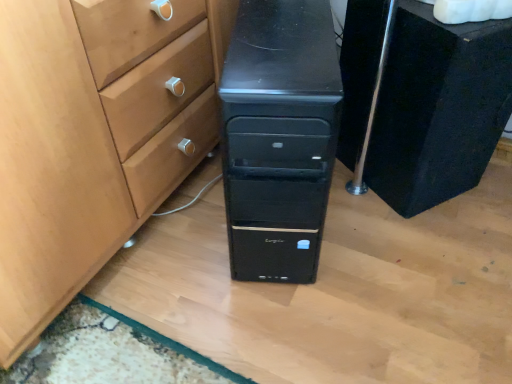
Question: Should I look upward or downward to see black matte chest of drawers at center, which appears as the first chest of drawers when viewed from the right?

Choices:
 (A) down
 (B) up

Answer: (B)

Question: Is black matte chest of drawers at center, which ranks as the first chest of drawers in left-to-right order, positioned beyond the bounds of black matte chest of drawers at center, which is the 2th chest of drawers from left to right?

Choices:
 (A) no
 (B) yes

Answer: (B)

Question: Can you confirm if black matte chest of drawers at center, which appears as the second chest of drawers when viewed from the right, is taller than black matte chest of drawers at center, which appears as the first chest of drawers when viewed from the right?

Choices:
 (A) yes
 (B) no

Answer: (A)

Question: Is black matte chest of drawers at center, which appears as the second chest of drawers when viewed from the right, smaller than black matte chest of drawers at center, which appears as the first chest of drawers when viewed from the right?

Choices:
 (A) no
 (B) yes

Answer: (A)

Question: From the image's perspective, would you say black matte chest of drawers at center, which ranks as the first chest of drawers in left-to-right order, is shown under black matte chest of drawers at center, which is the 2th chest of drawers from left to right?

Choices:
 (A) no
 (B) yes

Answer: (B)

Question: From a real-world perspective, is black matte chest of drawers at center, which appears as the second chest of drawers when viewed from the right, positioned under black matte chest of drawers at center, which appears as the first chest of drawers when viewed from the right, based on gravity?

Choices:
 (A) no
 (B) yes

Answer: (A)

Question: Considering the relative positions of black matte chest of drawers at center, which ranks as the first chest of drawers in left-to-right order, and black matte chest of drawers at center, which appears as the first chest of drawers when viewed from the right, in the image provided, is black matte chest of drawers at center, which ranks as the first chest of drawers in left-to-right order, behind black matte chest of drawers at center, which appears as the first chest of drawers when viewed from the right,?

Choices:
 (A) no
 (B) yes

Answer: (A)

Question: Is black matte chest of drawers at center, which is the 2th chest of drawers from left to right, positioned far away from black matte chest of drawers at center, which ranks as the first chest of drawers in left-to-right order?

Choices:
 (A) yes
 (B) no

Answer: (B)

Question: From a real-world perspective, is black matte chest of drawers at center, which is the 2th chest of drawers from left to right, on top of black matte chest of drawers at center, which appears as the second chest of drawers when viewed from the right?

Choices:
 (A) yes
 (B) no

Answer: (B)

Question: Is black matte chest of drawers at center, which appears as the first chest of drawers when viewed from the right, aimed at black matte chest of drawers at center, which ranks as the first chest of drawers in left-to-right order?

Choices:
 (A) no
 (B) yes

Answer: (A)

Question: Can you confirm if black matte chest of drawers at center, which appears as the first chest of drawers when viewed from the right, is bigger than black matte chest of drawers at center, which ranks as the first chest of drawers in left-to-right order?

Choices:
 (A) yes
 (B) no

Answer: (B)

Question: Is black matte chest of drawers at center, which appears as the first chest of drawers when viewed from the right, not inside black matte chest of drawers at center, which appears as the second chest of drawers when viewed from the right?

Choices:
 (A) no
 (B) yes

Answer: (B)

Question: Can you confirm if black matte chest of drawers at center, which is the 2th chest of drawers from left to right, is positioned to the right of black matte chest of drawers at center, which ranks as the first chest of drawers in left-to-right order?

Choices:
 (A) no
 (B) yes

Answer: (B)

Question: Choose the correct answer: Is black matte chest of drawers at center, which appears as the first chest of drawers when viewed from the right, inside black matte chest of drawers at center, which appears as the second chest of drawers when viewed from the right, or outside it?

Choices:
 (A) outside
 (B) inside

Answer: (A)